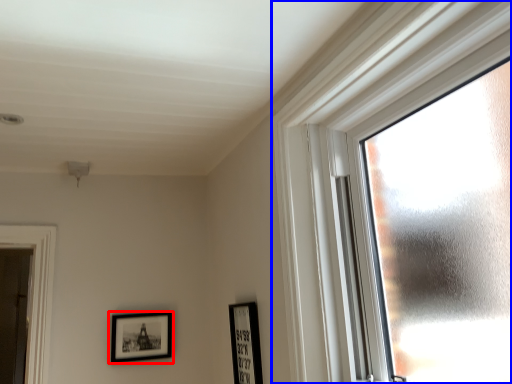
Question: Which object appears farthest to the camera in this image, picture frame (highlighted by a red box) or window (highlighted by a blue box)?

Choices:
 (A) picture frame
 (B) window

Answer: (A)